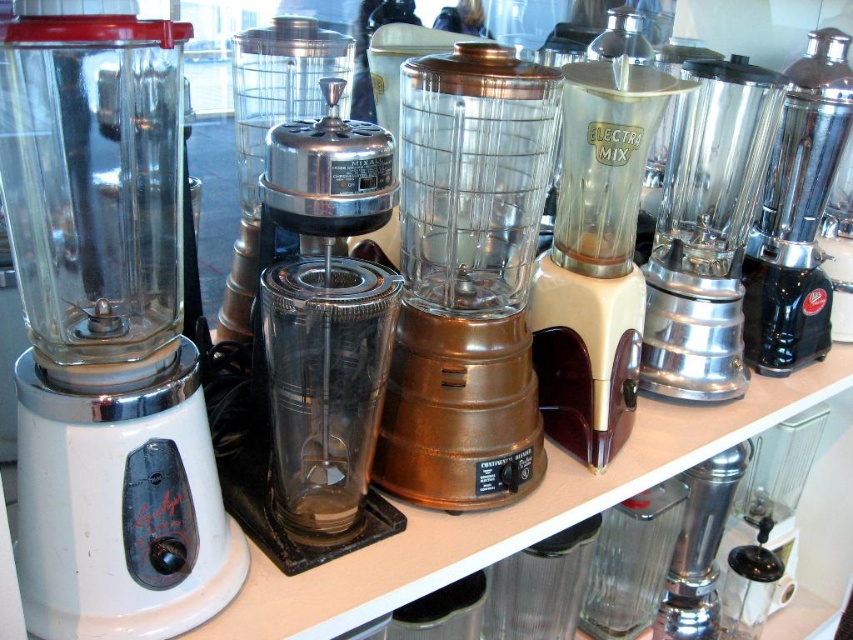
Question: Which object appears farthest from the camera in this image?

Choices:
 (A) copper metallic blender at center
 (B) shiny metallic blender at right
 (C) shiny chrome mixer at center
 (D) beige plastic blender at center

Answer: (B)

Question: Which object is positioned closest to the polished stainless steel mixer at right?

Choices:
 (A) copper metallic blender at center
 (B) shiny chrome mixer at center
 (C) shiny metallic blender at right

Answer: (C)

Question: Among these objects, which one is nearest to the camera?

Choices:
 (A) shiny metallic blender at right
 (B) copper metallic blender at center
 (C) beige plastic blender at center

Answer: (B)

Question: Does shiny metallic blender at right appear under polished stainless steel mixer at right?

Choices:
 (A) no
 (B) yes

Answer: (B)

Question: Can you confirm if white plastic blender at left is positioned above shiny chrome mixer at center?

Choices:
 (A) yes
 (B) no

Answer: (B)

Question: In this image, where is copper metallic blender at center located relative to shiny chrome mixer at center?

Choices:
 (A) above
 (B) below

Answer: (A)